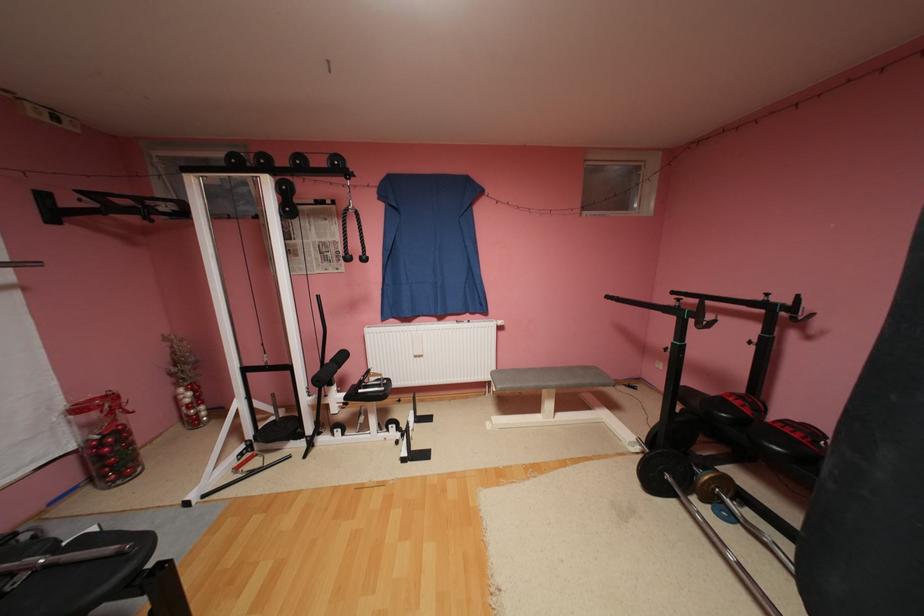
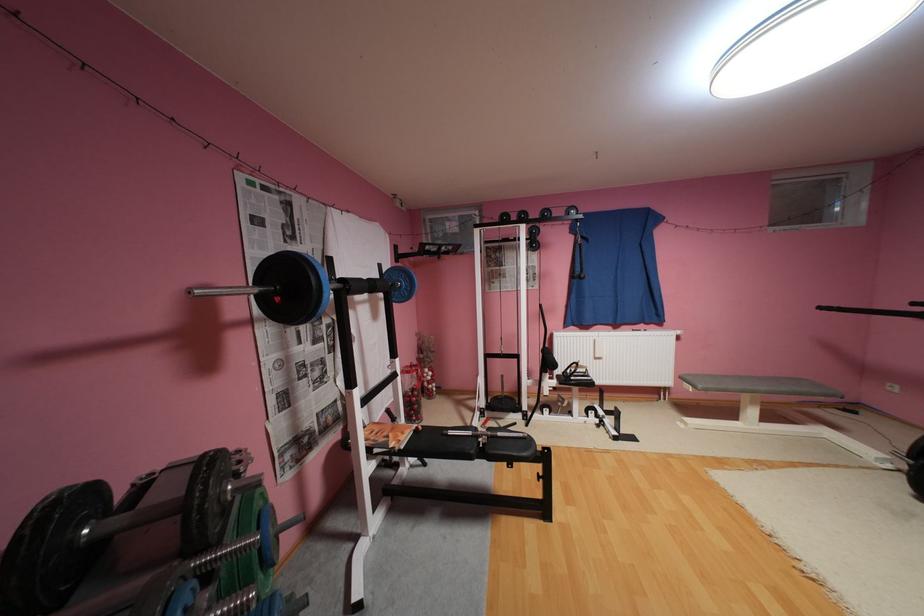
Locate, in the second image, the point that corresponds to [561,383] in the first image.

(771, 387)